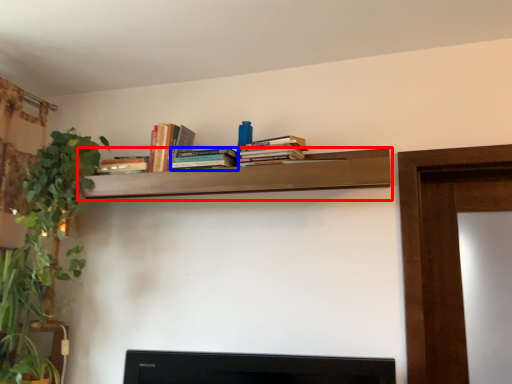
Question: Which object is closer to the camera taking this photo, shelf (highlighted by a red box) or book (highlighted by a blue box)?

Choices:
 (A) shelf
 (B) book

Answer: (A)